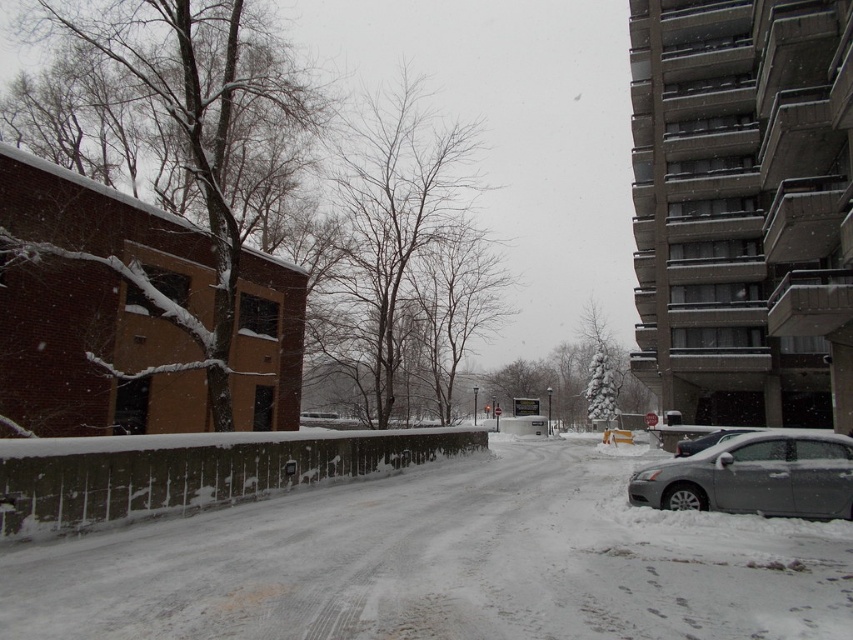
Looking at this image, does white powdery snow at center appear on the left side of sleek metallic sedan at right?

Indeed, white powdery snow at center is positioned on the left side of sleek metallic sedan at right.

Who is more forward, (184, 600) or (811, 508)?

Point (184, 600) is in front.

I want to click on white powdery snow at center, so click(x=444, y=563).